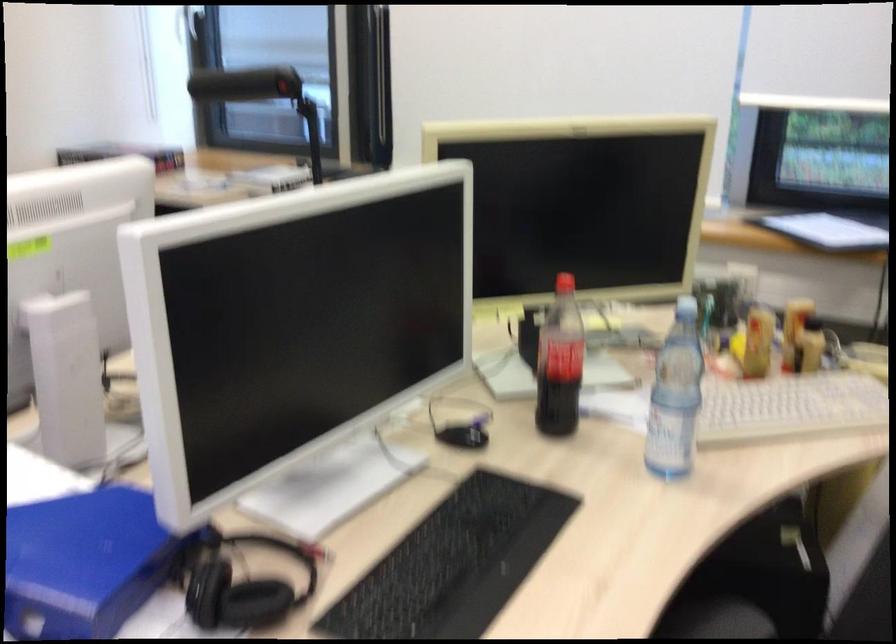
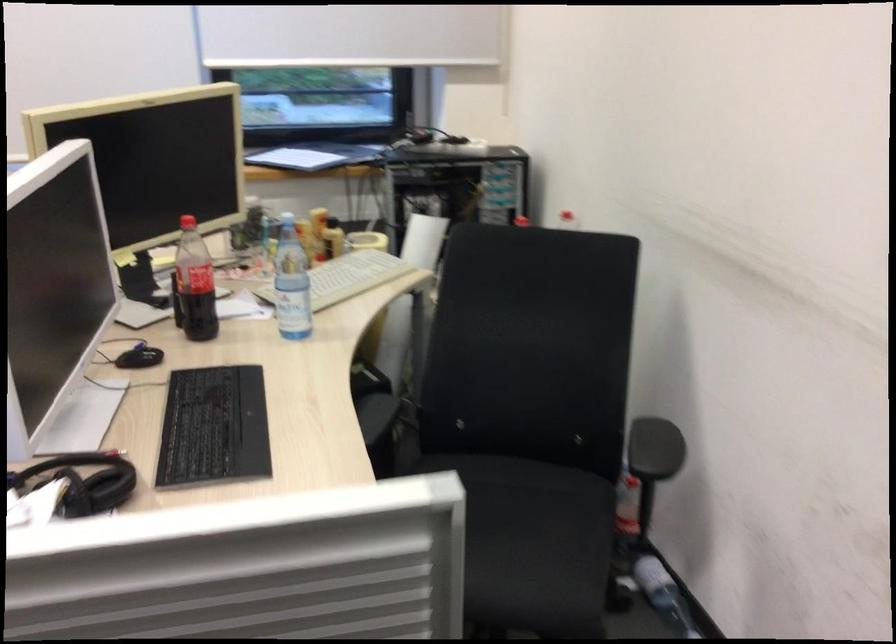
Where in the second image is the point corresponding to (x=806, y=406) from the first image?

(347, 277)